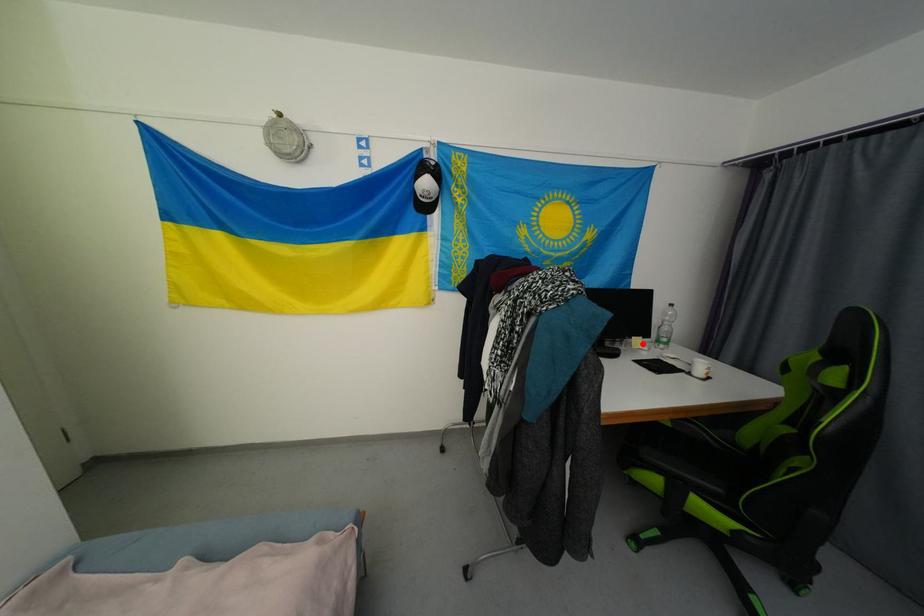
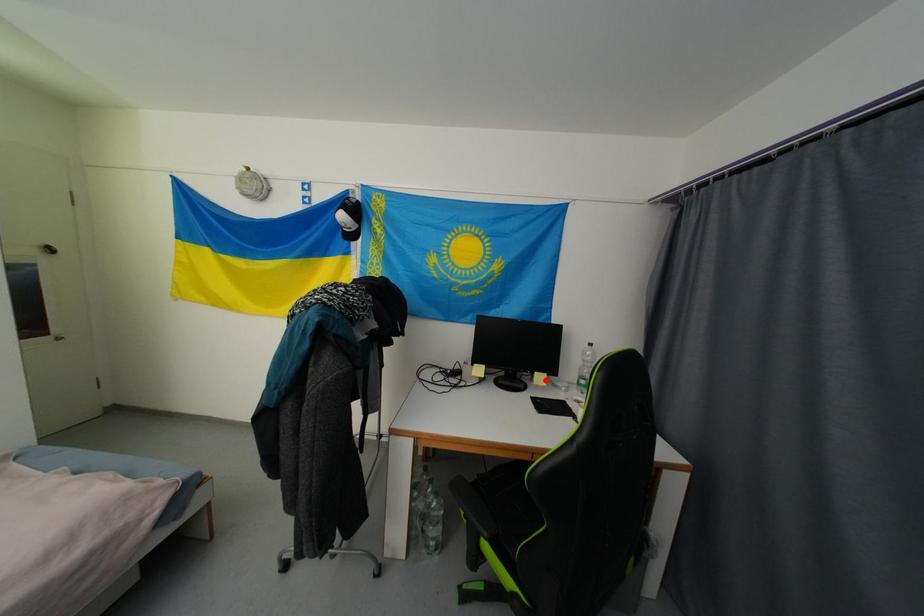
I am providing you with two images of the same scene from different viewpoints. A red point is marked on the first image and another point is marked on the second image. Do the highlighted points in image1 and image2 indicate the same real-world spot?

Yes